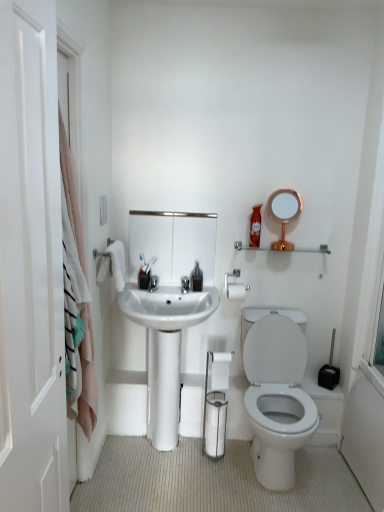
Question: In the image, is white matte toilet paper at center positioned in front of or behind metallic rectangular mirror at center, which is the 1th mirror in left-to-right order?

Choices:
 (A) behind
 (B) front

Answer: (B)

Question: From a real-world perspective, is white matte toilet paper at center physically located above or below metallic rectangular mirror at center, positioned as the 2th mirror in right-to-left order?

Choices:
 (A) above
 (B) below

Answer: (B)

Question: Estimate the real-world distances between objects in this image. Which object is farther from the rose gold metallic mirror at upper right, acting as the 1th mirror starting from the right?

Choices:
 (A) metallic rectangular mirror at center, positioned as the 2th mirror in right-to-left order
 (B) matte black toothbrush at center, which is the second toiletry from right to left
 (C) silver metallic towel bar at upper center
 (D) clear glass shelf at upper center
 (E) matte plastic soap dispenser at upper right, the first toiletry positioned from the right

Answer: (B)

Question: Which of these objects is positioned farthest from the clear glass shelf at upper center?

Choices:
 (A) white glossy sink at center
 (B) matte black toothbrush at center, the second toiletry from the top
 (C) matte plastic soap dispenser at upper right, which appears as the second toiletry when ordered from the bottom
 (D) rose gold metallic mirror at upper right, which is the second mirror from left to right
 (E) white matte door at left

Answer: (E)